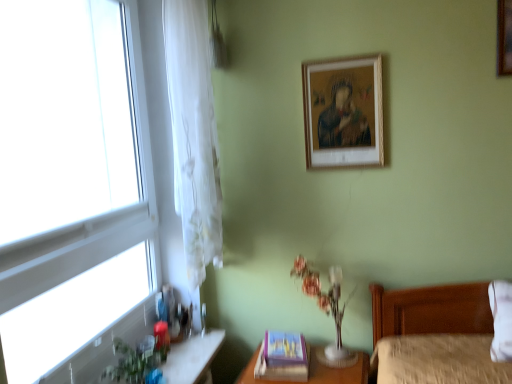
Question: Is wooden picture frame at upper right, which is the 1th picture frame from top to bottom, bigger than translucent glass vase at center?

Choices:
 (A) no
 (B) yes

Answer: (A)

Question: Does wooden picture frame at upper right, the third picture frame when ordered from left to right, come in front of translucent glass vase at center?

Choices:
 (A) no
 (B) yes

Answer: (B)

Question: Does wooden picture frame at upper right, which is the 1th picture frame from top to bottom, touch translucent glass vase at center?

Choices:
 (A) yes
 (B) no

Answer: (B)

Question: Is wooden picture frame at upper right, acting as the third picture frame starting from the bottom, behind translucent glass vase at center?

Choices:
 (A) no
 (B) yes

Answer: (A)

Question: Considering the relative positions of wooden picture frame at upper right, the third picture frame when ordered from left to right, and translucent glass vase at center in the image provided, is wooden picture frame at upper right, the third picture frame when ordered from left to right, to the left of translucent glass vase at center from the viewer's perspective?

Choices:
 (A) yes
 (B) no

Answer: (B)

Question: In terms of size, does transparent glass window at left appear bigger or smaller than wooden table at lower right?

Choices:
 (A) small
 (B) big

Answer: (B)

Question: Based on their positions, is transparent glass window at left located to the left or right of wooden table at lower right?

Choices:
 (A) left
 (B) right

Answer: (A)

Question: From a real-world perspective, is transparent glass window at left physically located above or below wooden table at lower right?

Choices:
 (A) below
 (B) above

Answer: (B)

Question: From the image's perspective, is transparent glass window at left located above or below wooden table at lower right?

Choices:
 (A) above
 (B) below

Answer: (A)

Question: Is purple cardboard picture frame at lower center, which is counted as the 1th picture frame, starting from the bottom, spatially inside white sheer curtain at left, or outside of it?

Choices:
 (A) outside
 (B) inside

Answer: (A)

Question: Considering the positions of purple cardboard picture frame at lower center, which is the third picture frame in right-to-left order, and white sheer curtain at left in the image, is purple cardboard picture frame at lower center, which is the third picture frame in right-to-left order, wider or thinner than white sheer curtain at left?

Choices:
 (A) wide
 (B) thin

Answer: (A)

Question: Considering the relative positions of purple cardboard picture frame at lower center, which is the third picture frame in right-to-left order, and white sheer curtain at left in the image provided, is purple cardboard picture frame at lower center, which is the third picture frame in right-to-left order, to the left or to the right of white sheer curtain at left?

Choices:
 (A) left
 (B) right

Answer: (B)

Question: From a real-world perspective, is purple cardboard picture frame at lower center, which is counted as the 1th picture frame, starting from the bottom, positioned above or below white sheer curtain at left?

Choices:
 (A) below
 (B) above

Answer: (A)

Question: From their relative heights in the image, would you say translucent glass vase at center is taller or shorter than wooden table at lower right?

Choices:
 (A) short
 (B) tall

Answer: (B)

Question: Relative to wooden table at lower right, is translucent glass vase at center in front or behind?

Choices:
 (A) behind
 (B) front

Answer: (A)